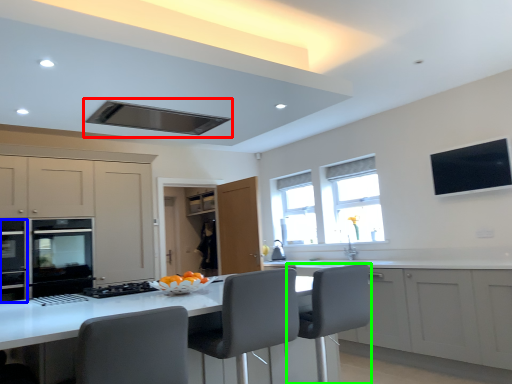
Question: Estimate the real-world distances between objects in this image. Which object is farther from exhaust hood (highlighted by a red box), appliance (highlighted by a blue box) or swivel chair (highlighted by a green box)?

Choices:
 (A) appliance
 (B) swivel chair

Answer: (A)